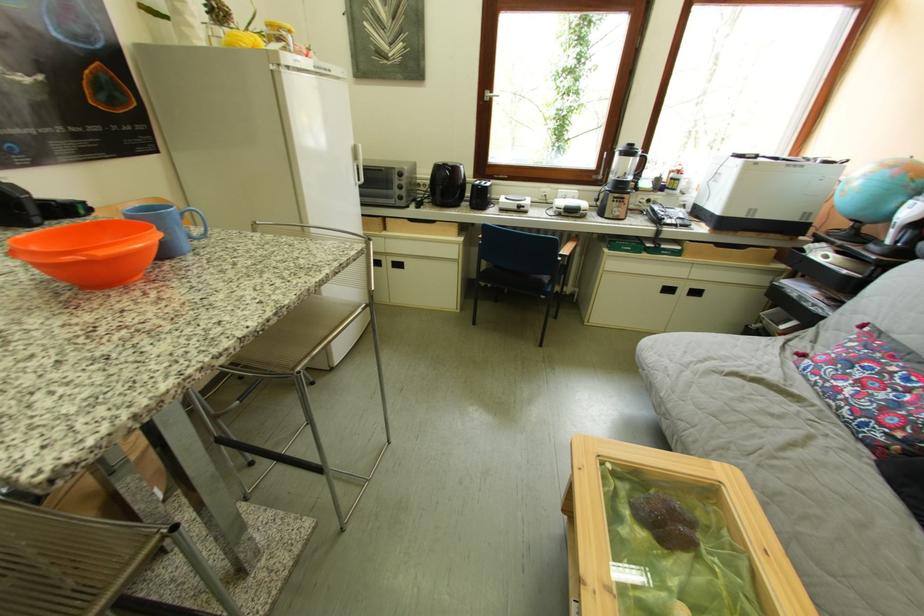
Locate an element on the screen. The height and width of the screenshot is (616, 924). blue mug handle is located at coordinates (198, 224).